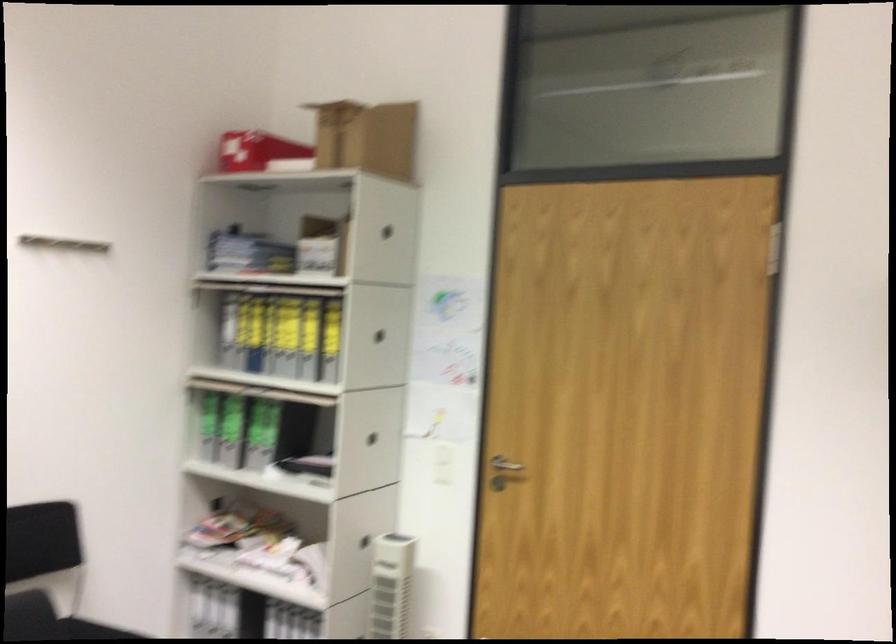
This screenshot has height=644, width=896. I want to click on white light switch, so click(444, 462).